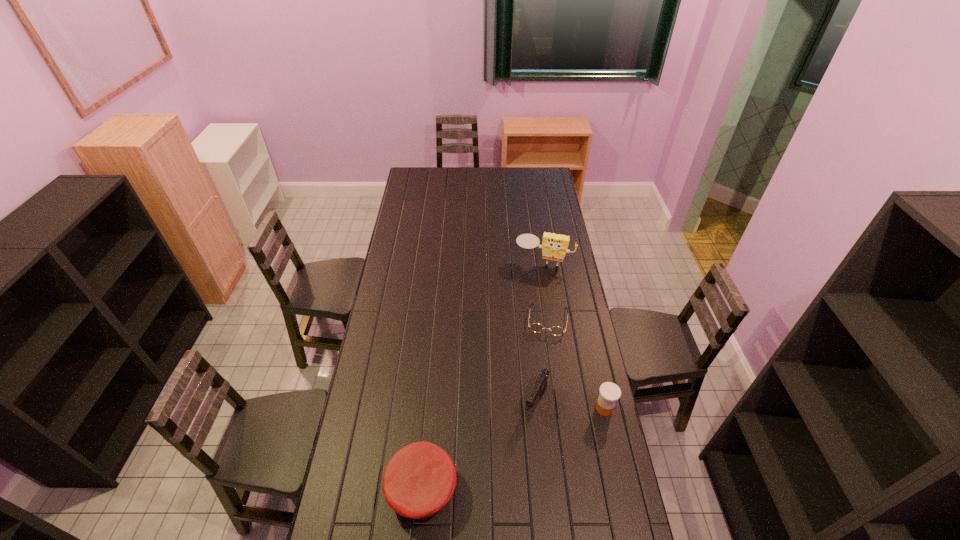
The height and width of the screenshot is (540, 960). In order to click on the nearest object in this screenshot , I will do `click(420, 478)`.

Where is `the leftmost object`? Image resolution: width=960 pixels, height=540 pixels. the leftmost object is located at coordinates (420, 478).

Identify the location of medicine. This screenshot has height=540, width=960. (609, 392).

This screenshot has height=540, width=960. Identify the location of spectacles. coord(535,327).

At what (x,y) coordinates should I click in order to perform the action: click on the second farthest object. Please return your answer as a coordinate pair (x, y). Looking at the image, I should click on (535, 327).

Where is `the tallest object`? the tallest object is located at coordinates (554, 247).

Where is `the farthest object`? The height and width of the screenshot is (540, 960). the farthest object is located at coordinates (554, 247).

You are a GUI agent. You are given a task and a screenshot of the screen. Output one action in this format:
    pyautogui.click(x=<x>, y=<y>)
    Task: Click on the pistol
    The height and width of the screenshot is (540, 960).
    Given the screenshot: What is the action you would take?
    pyautogui.click(x=540, y=386)

Identify the location of vacant space situated at the front of the leftmost object where the visor is located. (359, 489).

You are a GUI agent. You are given a task and a screenshot of the screen. Output one action in this format:
    pyautogui.click(x=<x>, y=<y>)
    Task: Click on the vacant space located at the front of the leftmost object where the visor is located
    Image resolution: width=960 pixels, height=540 pixels.
    Given the screenshot: What is the action you would take?
    pyautogui.click(x=353, y=489)